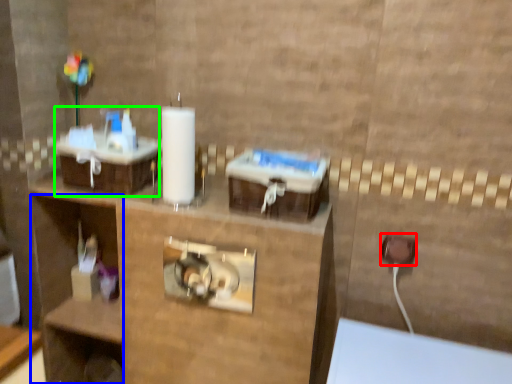
Question: Which is nearer to the electric outlet (highlighted by a red box)? shelf (highlighted by a blue box) or sink (highlighted by a green box).

Choices:
 (A) shelf
 (B) sink

Answer: (B)